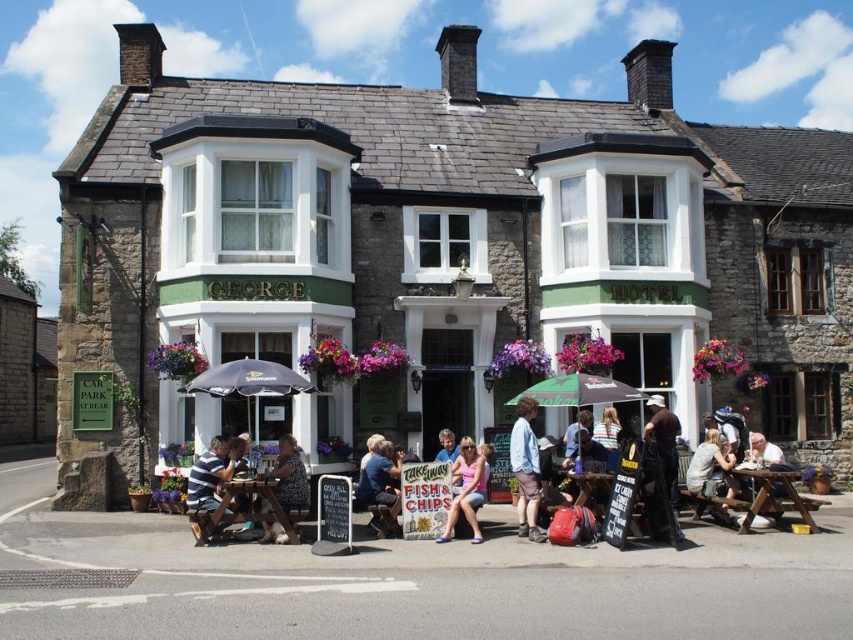
Question: Which point is farther from the camera taking this photo?

Choices:
 (A) (550, 376)
 (B) (276, 484)
 (C) (253, 362)

Answer: (A)

Question: Which of the following is the closest to the observer?

Choices:
 (A) denim jacket at center
 (B) blue denim shorts at center
 (C) brown leather jacket at center
 (D) matte pink shirt at center

Answer: (C)

Question: Does black fabric umbrella at center have a smaller size compared to patterned fabric shirt at center?

Choices:
 (A) no
 (B) yes

Answer: (A)

Question: Is denim shorts at lower center closer to the viewer compared to blue denim shorts at center?

Choices:
 (A) no
 (B) yes

Answer: (A)

Question: Based on their relative distances, which object is nearer to the patterned fabric shirt at center?

Choices:
 (A) brown leather jacket at center
 (B) striped cotton shirt at lower left

Answer: (B)

Question: Can you confirm if denim jacket at center is positioned below striped cotton shirt at lower left?

Choices:
 (A) yes
 (B) no

Answer: (A)